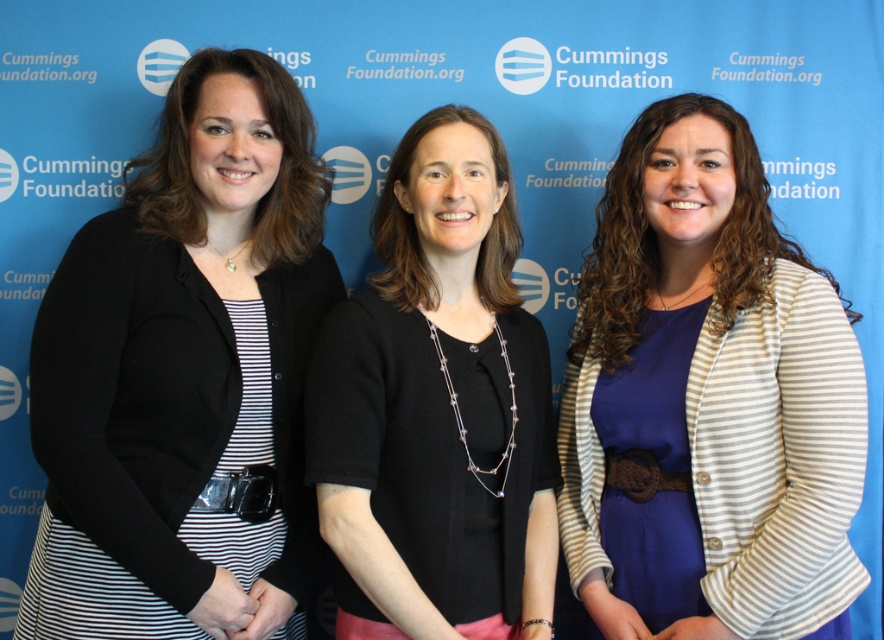
Question: Based on their relative distances, which object is farther from the black matte blazer at left?

Choices:
 (A) striped fabric dress at center
 (B) black matte sweater at center

Answer: (A)

Question: Does striped fabric dress at center have a smaller size compared to black matte sweater at center?

Choices:
 (A) yes
 (B) no

Answer: (B)

Question: Is striped fabric dress at center smaller than black matte sweater at center?

Choices:
 (A) yes
 (B) no

Answer: (B)

Question: Which object is the farthest from the black matte sweater at center?

Choices:
 (A) striped fabric dress at center
 (B) black matte blazer at left

Answer: (A)

Question: Which of the following is the closest to the observer?

Choices:
 (A) black matte sweater at center
 (B) striped fabric dress at center
 (C) black matte blazer at left

Answer: (C)

Question: Does black matte blazer at left appear on the right side of black matte sweater at center?

Choices:
 (A) yes
 (B) no

Answer: (B)